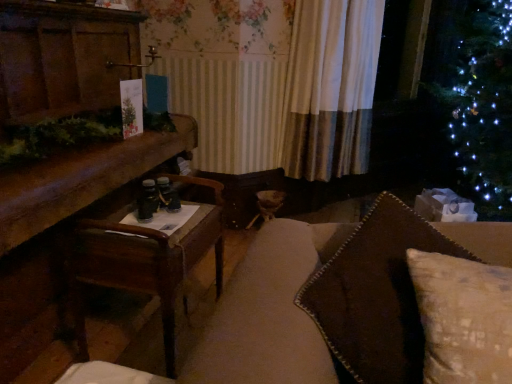
What do you see at coordinates (463, 318) in the screenshot?
I see `brown textured pillow at right` at bounding box center [463, 318].

Measure the distance between white textured curtain at center and camera.

white textured curtain at center is 7.49 feet from camera.

Locate an element on the screen. Image resolution: width=512 pixels, height=384 pixels. wooden table at left is located at coordinates (63, 229).

How different are the orientations of wooden table at left and wooden table at left in degrees?

175 degrees.

Which of these two, wooden table at left or wooden table at left, is bigger?

wooden table at left.

Does wooden table at left appear on the right side of wooden table at left?

Yes, wooden table at left is to the right of wooden table at left.

Is wooden table at left completely or partially inside white textured curtain at center?

Actually, wooden table at left is outside white textured curtain at center.

Between white textured curtain at center and wooden table at left, which one appears on the left side from the viewer's perspective?

From the viewer's perspective, wooden table at left appears more on the left side.

This screenshot has width=512, height=384. I want to click on table in front of the white textured curtain at center, so click(x=145, y=261).

From a real-world perspective, between white textured curtain at center and wooden table at left, who is vertically higher?

In real-world perspective, white textured curtain at center is above.

Which is more to the right, wooden table at left or wooden table at left?

From the viewer's perspective, wooden table at left appears more on the right side.

Looking at this image, is wooden table at left bigger or smaller than wooden table at left?

Clearly, wooden table at left is larger in size than wooden table at left.

Would you consider wooden table at left to be distant from wooden table at left?

That's not correct — wooden table at left is a little close to wooden table at left.

Measure the distance from brown textured pillow at right to wooden table at left.

A distance of 84.69 centimeters exists between brown textured pillow at right and wooden table at left.

From the image's perspective, between brown textured pillow at right and wooden table at left, who is located below?

wooden table at left is shown below in the image.

How different are the orientations of brown textured pillow at right and wooden table at left in degrees?

They differ by 93.9 degrees in their facing directions.

Is brown textured pillow at right beside wooden table at left?

No, brown textured pillow at right is not beside wooden table at left.

From the picture: Is white textured curtain at center surrounding wooden table at left?

No, wooden table at left is not a part of white textured curtain at center.

Which of these two, white textured curtain at center or wooden table at left, stands taller?

Standing taller between the two is wooden table at left.

Where is `curtain on the right of wooden table at left`? The height and width of the screenshot is (384, 512). curtain on the right of wooden table at left is located at coordinates (331, 88).

Based on the photo, from a real-world perspective, is white textured curtain at center beneath wooden table at left?

No, from a real-world perspective, white textured curtain at center is not under wooden table at left.

Could you tell me if brown textured pillow at right is turned towards white textured curtain at center?

No, brown textured pillow at right does not turn towards white textured curtain at center.

Is brown textured pillow at right positioned beyond the bounds of white textured curtain at center?

Indeed, brown textured pillow at right is completely outside white textured curtain at center.

Can you confirm if brown textured pillow at right is thinner than white textured curtain at center?

No, brown textured pillow at right is not thinner than white textured curtain at center.

How far apart are brown textured pillow at right and white textured curtain at center?

They are 6.08 feet apart.

Is white textured curtain at center looking in the opposite direction of brown textured pillow at right?

white textured curtain at center is not turned away from brown textured pillow at right.

Considering their positions, is white textured curtain at center located in front of or behind brown textured pillow at right?

white textured curtain at center is positioned farther from the viewer than brown textured pillow at right.

Identify the location of table that is behind the wooden table at left. Image resolution: width=512 pixels, height=384 pixels. (145, 261).

Find the location of a particular element. table lying in front of the white textured curtain at center is located at coordinates (145, 261).

Considering their positions, is white textured curtain at center positioned further to wooden table at left than brown textured pillow at right?

white textured curtain at center is further to wooden table at left.

Estimate the real-world distances between objects in this image. Which object is closer to wooden table at left, white textured curtain at center or wooden table at left?

wooden table at left lies closer to wooden table at left than the other object.

Based on their spatial positions, is brown textured pillow at right or wooden table at left closer to wooden table at left?

The object closer to wooden table at left is wooden table at left.

When comparing their distances from wooden table at left, does wooden table at left or white textured curtain at center seem further?

Among the two, white textured curtain at center is located further to wooden table at left.

From the image, which object appears to be nearer to white textured curtain at center, wooden table at left or wooden table at left?

wooden table at left is closer to white textured curtain at center.

When comparing their distances from brown textured pillow at right, does white textured curtain at center or wooden table at left seem further?

white textured curtain at center.

Which object lies further to the anchor point white textured curtain at center, brown textured pillow at right or wooden table at left?

Based on the image, brown textured pillow at right appears to be further to white textured curtain at center.

From the image, which object appears to be nearer to wooden table at left, wooden table at left or brown textured pillow at right?

Based on the image, wooden table at left appears to be nearer to wooden table at left.

The width and height of the screenshot is (512, 384). Identify the location of furniture between brown textured pillow at right and white textured curtain at center in the front-back direction. (63, 229).

Image resolution: width=512 pixels, height=384 pixels. I want to click on table between wooden table at left and white textured curtain at center in the front-back direction, so click(x=145, y=261).

This screenshot has width=512, height=384. I want to click on table between wooden table at left and brown textured pillow at right in the horizontal direction, so click(145, 261).

Where is `table between brown textured pillow at right and white textured curtain at center from front to back`? This screenshot has width=512, height=384. table between brown textured pillow at right and white textured curtain at center from front to back is located at coordinates (145, 261).